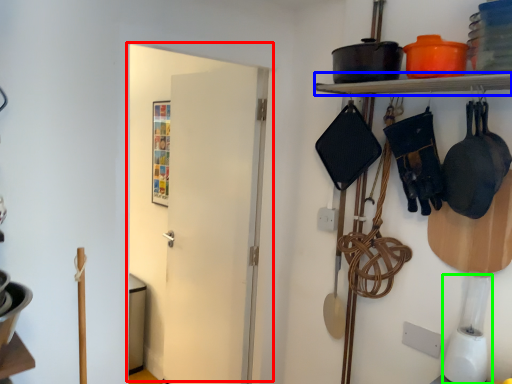
Question: Based on their relative distances, which object is farther from door (highlighted by a red box)? Choose from shelf (highlighted by a blue box) and appliance (highlighted by a green box).

Choices:
 (A) shelf
 (B) appliance

Answer: (B)